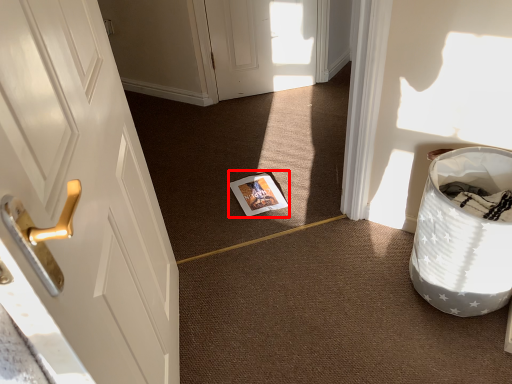
Question: Where is magazine (annotated by the red box) located in relation to laundry basket in the image?

Choices:
 (A) right
 (B) left

Answer: (B)